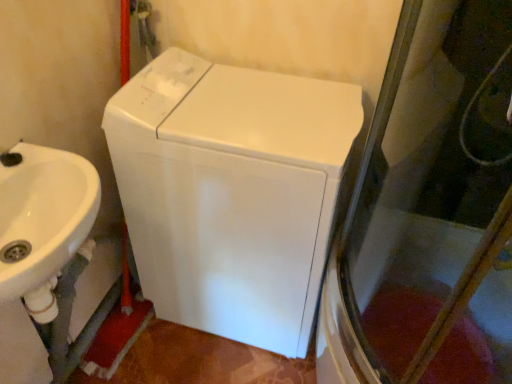
Question: Can you confirm if white glossy sink at left is shorter than white glossy washing machine at center?

Choices:
 (A) yes
 (B) no

Answer: (A)

Question: Is white glossy sink at left facing towards white glossy washing machine at center?

Choices:
 (A) yes
 (B) no

Answer: (B)

Question: From the image's perspective, would you say white glossy sink at left is shown under white glossy washing machine at center?

Choices:
 (A) yes
 (B) no

Answer: (A)

Question: From the image's perspective, does white glossy sink at left appear higher than white glossy washing machine at center?

Choices:
 (A) yes
 (B) no

Answer: (B)

Question: Can you confirm if white glossy sink at left is bigger than white glossy washing machine at center?

Choices:
 (A) yes
 (B) no

Answer: (B)

Question: Is white glossy sink at left wider than white glossy washing machine at center?

Choices:
 (A) yes
 (B) no

Answer: (B)

Question: Is white glossy washing machine at center positioned beyond the bounds of white glossy sink at left?

Choices:
 (A) no
 (B) yes

Answer: (B)

Question: From the image's perspective, does white glossy washing machine at center appear lower than white glossy sink at left?

Choices:
 (A) yes
 (B) no

Answer: (B)

Question: Can you confirm if white glossy washing machine at center is bigger than white glossy sink at left?

Choices:
 (A) no
 (B) yes

Answer: (B)

Question: From a real-world perspective, is white glossy washing machine at center located beneath white glossy sink at left?

Choices:
 (A) no
 (B) yes

Answer: (B)

Question: Can you confirm if white glossy washing machine at center is wider than white glossy sink at left?

Choices:
 (A) yes
 (B) no

Answer: (A)

Question: Is there a large distance between white glossy washing machine at center and white glossy sink at left?

Choices:
 (A) no
 (B) yes

Answer: (A)

Question: Is white glossy sink at left wider or thinner than white glossy washing machine at center?

Choices:
 (A) thin
 (B) wide

Answer: (A)